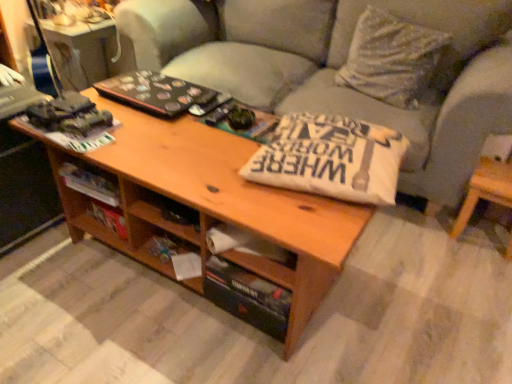
Question: Considering the positions of point 495,168 and point 424,79, is point 495,168 closer or farther from the camera than point 424,79?

Choices:
 (A) farther
 (B) closer

Answer: (B)

Question: Relative to white textured pillow at upper right, is light brown wood side table at lower right in front or behind?

Choices:
 (A) behind
 (B) front

Answer: (B)

Question: Estimate the real-world distances between objects in this image. Which object is closer to the light brown wood side table at lower right?

Choices:
 (A) wooden drawer at center
 (B) light gray fabric couch at center
 (C) white textured pillow at upper right
 (D) white cotton pillow at center

Answer: (C)

Question: Considering the real-world distances, which object is closest to the wooden drawer at center?

Choices:
 (A) light gray fabric couch at center
 (B) white cotton pillow at center
 (C) light brown wood side table at lower right
 (D) white textured pillow at upper right

Answer: (B)